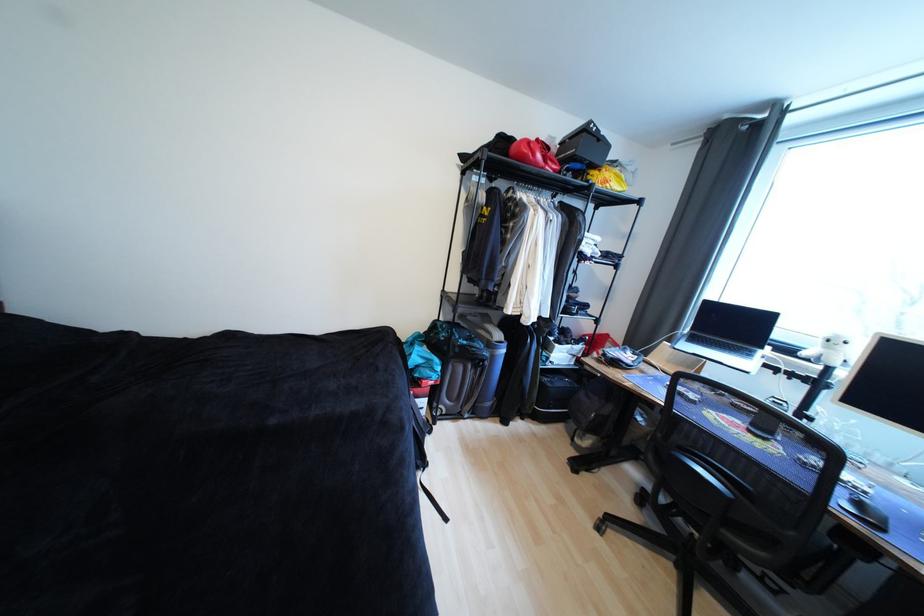
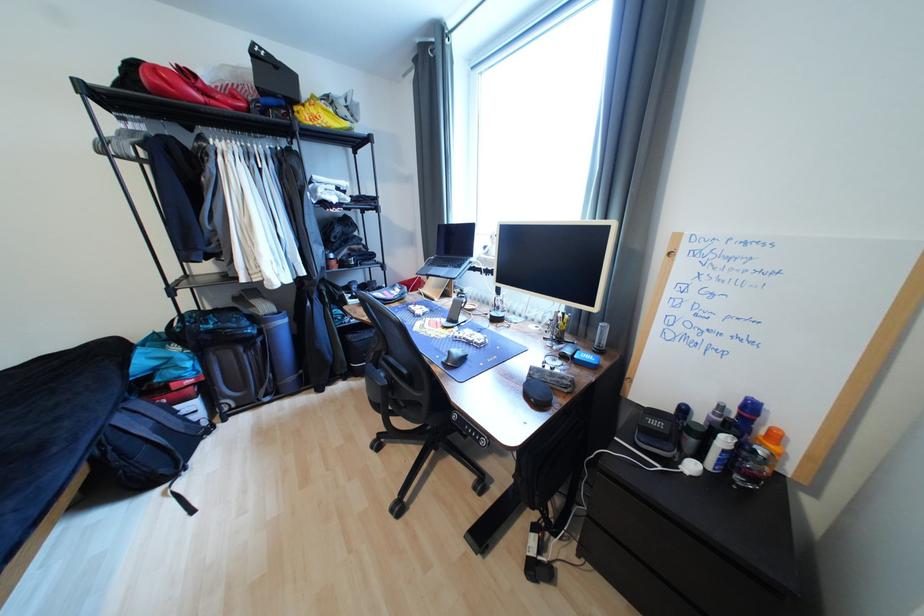
Question: What movement of the cameraman would produce the second image?

Choices:
 (A) Left
 (B) Right
 (C) Forward
 (D) Backward

Answer: (B)